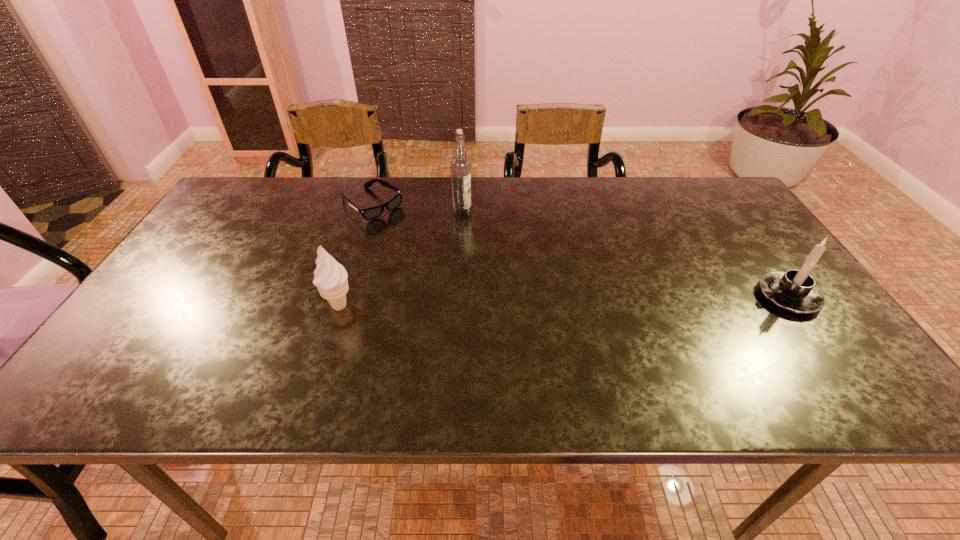
Find the location of a particular element. icecream is located at coordinates (331, 277).

Where is `candle holder`? candle holder is located at coordinates (795, 291).

Locate an element on the screen. The image size is (960, 540). sunglasses is located at coordinates (371, 213).

This screenshot has height=540, width=960. Find the location of `the second object from right to left`. the second object from right to left is located at coordinates (460, 166).

This screenshot has width=960, height=540. Identify the location of the tallest object. (460, 166).

Image resolution: width=960 pixels, height=540 pixels. Identify the location of blank area located on the front-facing side of the icecream. (321, 364).

Find the location of a particular element. The image size is (960, 540). vacant space located 0.080m with a handle on the side of the candle holder is located at coordinates (726, 296).

Image resolution: width=960 pixels, height=540 pixels. What are the coordinates of `vacant space located with a handle on the side of the candle holder` in the screenshot? It's located at (713, 296).

The width and height of the screenshot is (960, 540). I want to click on vacant region located with a handle on the side of the candle holder, so click(652, 296).

I want to click on vacant region located on the front-facing side of the sunglasses, so click(x=482, y=285).